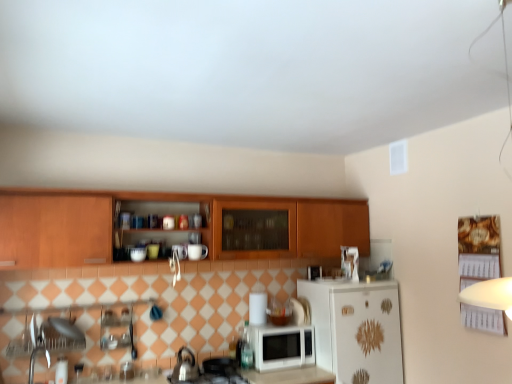
Question: From the image's perspective, is white glossy microwave at center positioned above or below wooden cabinets at center?

Choices:
 (A) below
 (B) above

Answer: (A)

Question: Choose the correct answer: Is white glossy microwave at center inside wooden cabinets at center or outside it?

Choices:
 (A) inside
 (B) outside

Answer: (B)

Question: Based on their relative distances, which object is nearer to the wooden cabinets at center?

Choices:
 (A) white matte refrigerator at lower right
 (B) white glossy microwave at center
 (C) white matte microwave at center
 (D) brushed metal tea pot at lower center

Answer: (A)

Question: Considering the real-world distances, which object is closest to the white glossy microwave at center?

Choices:
 (A) white matte refrigerator at lower right
 (B) wooden cabinets at center
 (C) brushed metal tea pot at lower center
 (D) white matte microwave at center

Answer: (A)